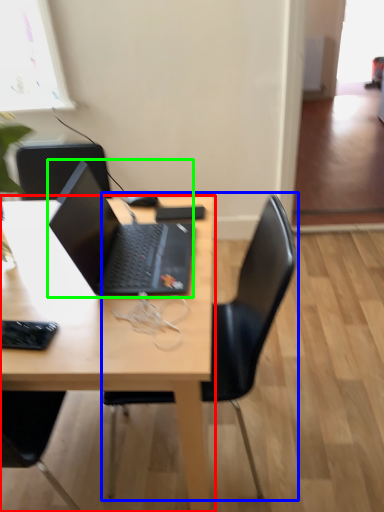
Question: Which is farther away from desk (highlighted by a red box)? chair (highlighted by a blue box) or laptop (highlighted by a green box)?

Choices:
 (A) chair
 (B) laptop

Answer: (A)